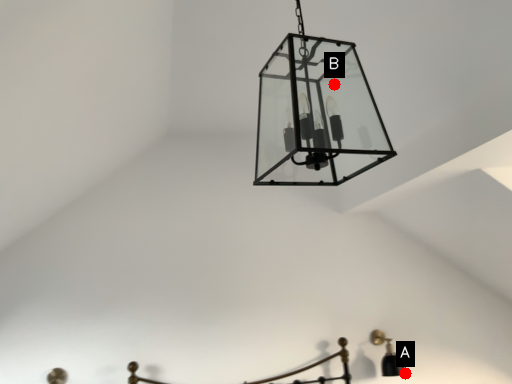
Question: Two points are circled on the image, labeled by A and B beside each circle. Which of the following is the farthest from the observer?

Choices:
 (A) A is further
 (B) B is further

Answer: (A)